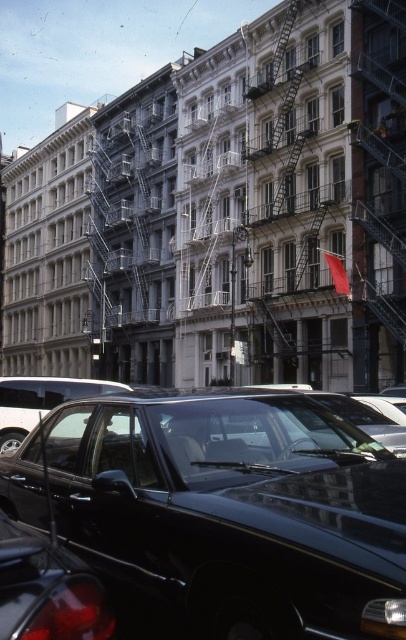
Between glossy black car at lower center and glossy plastic car at lower left, which one is positioned lower?

glossy plastic car at lower left is below.

Find the location of a particular element. glossy black car at lower center is located at coordinates (224, 509).